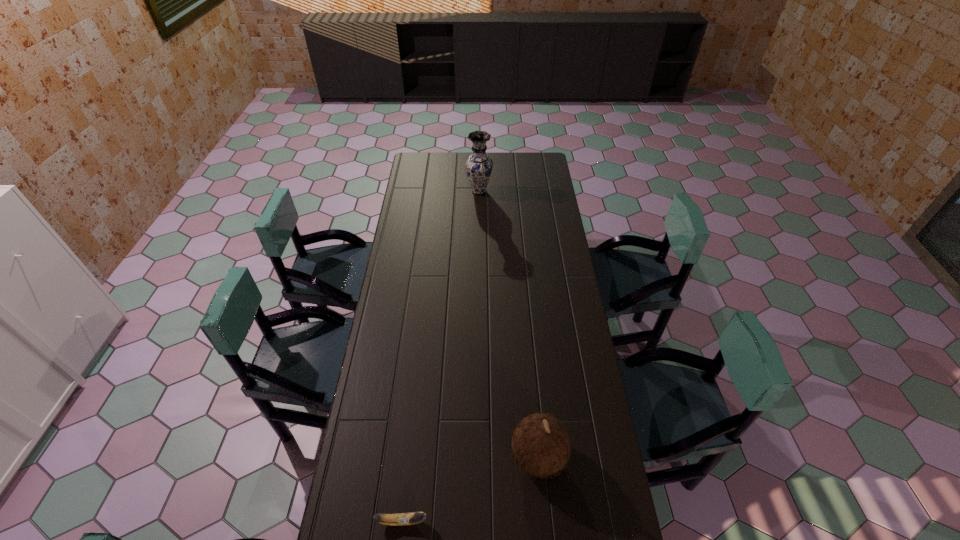
At what (x,y) coordinates should I click in order to perform the action: click on vacant point located 0.180m on the peel of the banana. Please return your answer as a coordinate pair (x, y). Image resolution: width=960 pixels, height=540 pixels. Looking at the image, I should click on (490, 521).

I want to click on object positioned at the left edge, so click(401, 519).

Where is `object that is at the right edge`? This screenshot has width=960, height=540. object that is at the right edge is located at coordinates (540, 444).

Locate an element on the screen. The width and height of the screenshot is (960, 540). free space at the far edge of the desktop is located at coordinates (456, 170).

Image resolution: width=960 pixels, height=540 pixels. Identify the location of vacant area at the left edge. (426, 181).

This screenshot has height=540, width=960. I want to click on free region at the right edge of the desktop, so click(548, 196).

Find the location of `vacant space at the far left corner of the desktop`. vacant space at the far left corner of the desktop is located at coordinates (415, 164).

In order to click on free space at the far right corner in this screenshot , I will do `click(522, 156)`.

This screenshot has height=540, width=960. Identify the location of free spot between the nearest object and the farthest object. (441, 356).

Find the location of a particular element. free spot between the vase and the coconut is located at coordinates (509, 323).